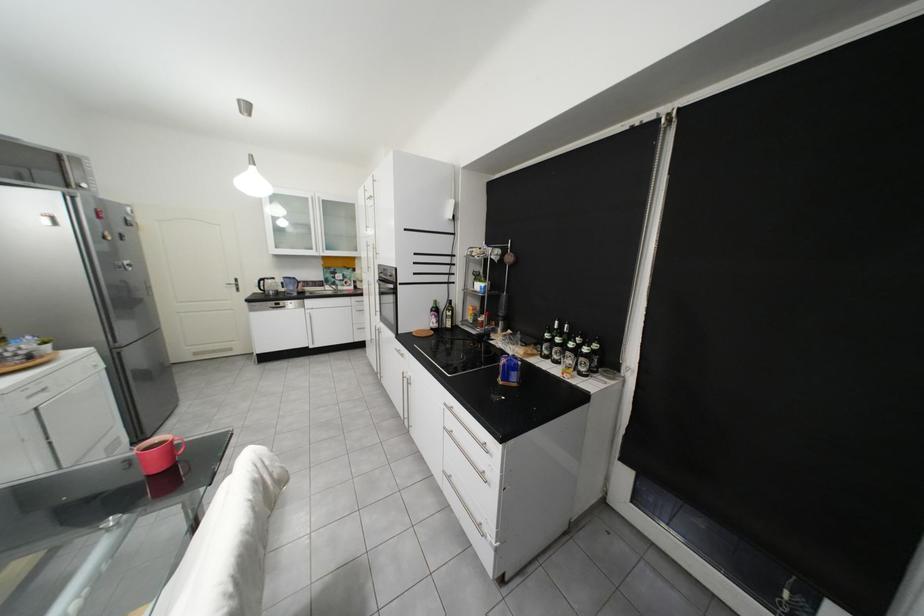
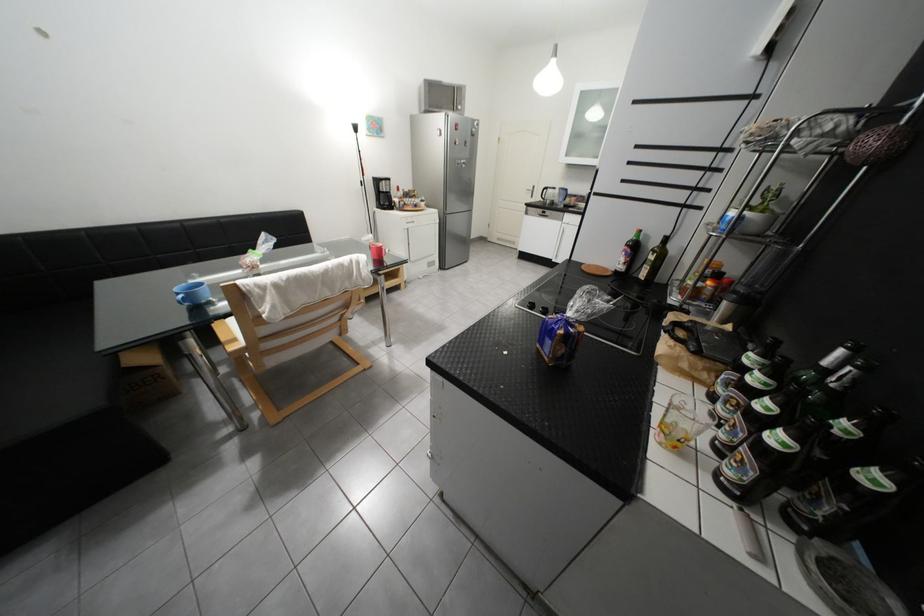
Find the pixel in the second image that matches [531,363] in the first image.

(574, 333)